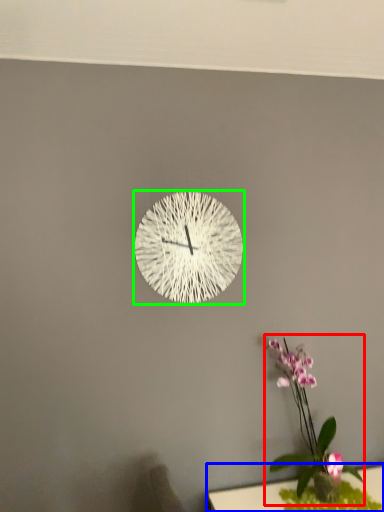
Question: Considering the real-world distances, which object is farthest from floral arrangement (highlighted by a red box)? table (highlighted by a blue box) or wall clock (highlighted by a green box)?

Choices:
 (A) table
 (B) wall clock

Answer: (B)